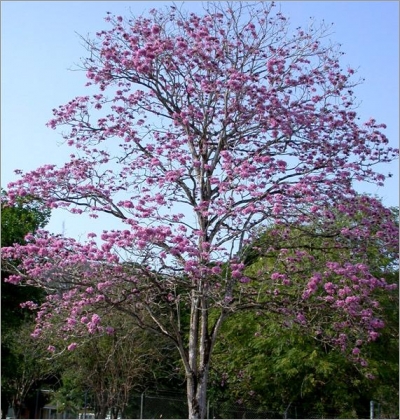
Where is `box`? box is located at coordinates (91, 415).